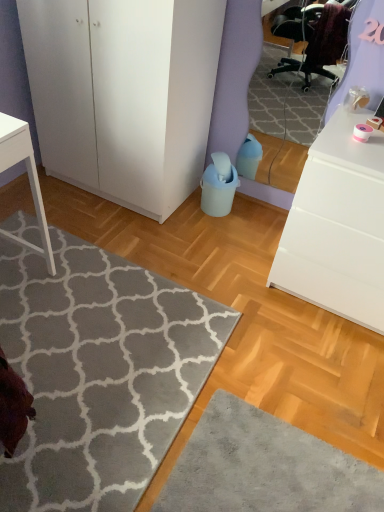
The image size is (384, 512). What do you see at coordinates (124, 94) in the screenshot?
I see `white matte cabinet at left` at bounding box center [124, 94].

Describe the element at coordinates (99, 373) in the screenshot. The width and height of the screenshot is (384, 512). I see `gray soft rug at lower left` at that location.

This screenshot has width=384, height=512. Find the location of `white matte chest of drawers at right`. white matte chest of drawers at right is located at coordinates (337, 226).

Does gray soft rug at lower left contain white matte cabinet at left?

No.

From the image's perspective, which one is positioned lower, gray soft rug at lower left or white matte cabinet at left?

gray soft rug at lower left, from the image's perspective.

Considering the positions of points (162, 303) and (101, 41), is point (162, 303) farther from camera compared to point (101, 41)?

Yes, it is behind point (101, 41).

Which is more to the right, gray soft rug at lower left or white matte cabinet at left?

From the viewer's perspective, white matte cabinet at left appears more on the right side.

In the scene shown: Is white matte cabinet at left bigger or smaller than gray soft rug at lower left?

white matte cabinet at left is bigger than gray soft rug at lower left.

Is white matte cabinet at left taller than gray soft rug at lower left?

Correct, white matte cabinet at left is much taller as gray soft rug at lower left.

From the image's perspective, which is above, white matte cabinet at left or gray soft rug at lower left?

From the image's view, white matte cabinet at left is above.

Considering the positions of point (49, 73) and point (52, 445), is point (49, 73) closer or farther from the camera than point (52, 445)?

Point (49, 73) is farther from the camera than point (52, 445).

You are a GUI agent. You are given a task and a screenshot of the screen. Output one action in this format:
    pyautogui.click(x=<x>, y=<y>)
    Task: Click on the cabinetry behind the white matte chest of drawers at right
    
    Given the screenshot: What is the action you would take?
    pyautogui.click(x=124, y=94)

Considering the sizes of objects white matte cabinet at left and white matte chest of drawers at right in the image provided, who is thinner, white matte cabinet at left or white matte chest of drawers at right?

white matte chest of drawers at right is thinner.

Between white matte cabinet at left and white matte chest of drawers at right, which one is positioned behind?

white matte cabinet at left.

From the image's perspective, which is above, white matte cabinet at left or white matte chest of drawers at right?

white matte cabinet at left, from the image's perspective.

Between gray soft rug at lower left and white matte chest of drawers at right, which one appears on the left side from the viewer's perspective?

From the viewer's perspective, gray soft rug at lower left appears more on the left side.

Is gray soft rug at lower left further to the viewer compared to white matte chest of drawers at right?

No, it is not.

Based on the photo, choose the correct answer: Is gray soft rug at lower left inside white matte chest of drawers at right or outside it?

gray soft rug at lower left is outside white matte chest of drawers at right.

In terms of size, does gray soft rug at lower left appear bigger or smaller than white matte chest of drawers at right?

gray soft rug at lower left is smaller than white matte chest of drawers at right.

From the image's perspective, which one is positioned higher, white matte chest of drawers at right or gray soft rug at lower left?

From the image's view, white matte chest of drawers at right is above.

Is white matte chest of drawers at right inside the boundaries of gray soft rug at lower left, or outside?

white matte chest of drawers at right is not inside gray soft rug at lower left, it's outside.

Is white matte chest of drawers at right positioned far away from gray soft rug at lower left?

No, there isn't a large distance between white matte chest of drawers at right and gray soft rug at lower left.

Between white matte chest of drawers at right and white matte cabinet at left, which one has smaller width?

With smaller width is white matte chest of drawers at right.

Based on the photo, from the image's perspective, is white matte chest of drawers at right located beneath white matte cabinet at left?

Correct, white matte chest of drawers at right appears lower than white matte cabinet at left in the image.

In the scene shown: Could white matte cabinet at left be considered to be inside white matte chest of drawers at right?

Definitely not — white matte cabinet at left is not inside white matte chest of drawers at right.

Who is taller, white matte chest of drawers at right or white matte cabinet at left?

white matte cabinet at left.

Find the location of `cabinetry on the right of gray soft rug at lower left`. cabinetry on the right of gray soft rug at lower left is located at coordinates (124, 94).

Locate an element on the screen. The width and height of the screenshot is (384, 512). doormat lying in front of the white matte cabinet at left is located at coordinates (99, 373).

Considering their positions, is gray soft rug at lower left positioned closer to white matte chest of drawers at right than white matte cabinet at left?

gray soft rug at lower left is closer to white matte chest of drawers at right.

In the scene shown: When comparing their distances from white matte cabinet at left, does white matte chest of drawers at right or gray soft rug at lower left seem further?

white matte chest of drawers at right is further to white matte cabinet at left.

Which object lies further to the anchor point gray soft rug at lower left, white matte chest of drawers at right or white matte cabinet at left?

Answer: Among the two, white matte cabinet at left is located further to gray soft rug at lower left.

Looking at the image, which one is located closer to gray soft rug at lower left, white matte cabinet at left or white matte chest of drawers at right?

white matte chest of drawers at right is closer to gray soft rug at lower left.

Estimate the real-world distances between objects in this image. Which object is further from white matte chest of drawers at right, white matte cabinet at left or gray soft rug at lower left?

Based on the image, white matte cabinet at left appears to be further to white matte chest of drawers at right.

Considering their positions, is gray soft rug at lower left positioned closer to white matte cabinet at left than white matte chest of drawers at right?

Among the two, gray soft rug at lower left is located nearer to white matte cabinet at left.

Image resolution: width=384 pixels, height=512 pixels. I want to click on cabinetry situated between gray soft rug at lower left and white matte chest of drawers at right from left to right, so click(x=124, y=94).